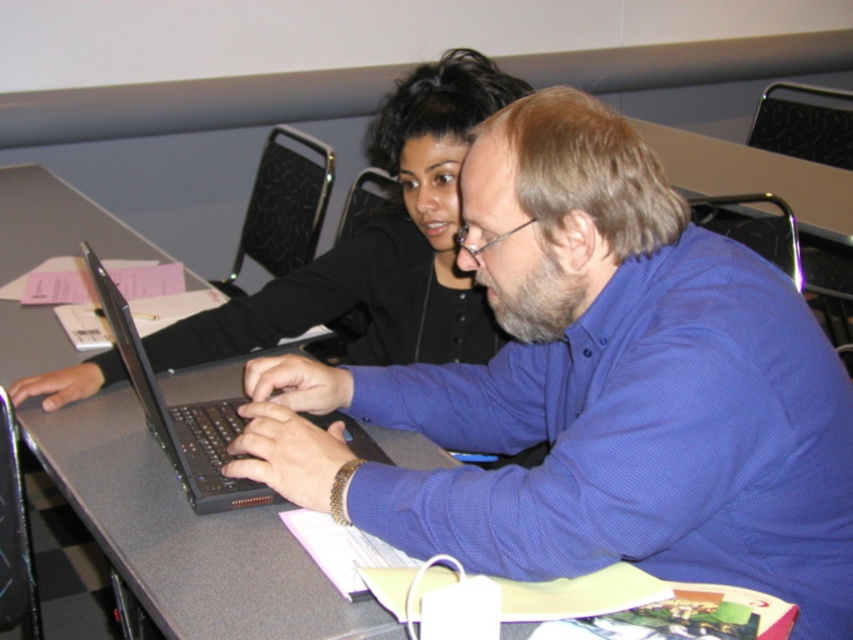
You are a photographer trying to capture a clear shot of both the black matte shirt at upper center and the black matte laptop at center. Since you want both subjects in focus, you need to adjust your camera settings based on their height. Which object should you focus on first to ensure both are in focus?

The black matte shirt at upper center is taller than the black matte laptop at center, so focusing on the taller object first will help ensure both are in focus.

You are a photographer trying to capture a clear shot of both the blue matte shirt at center and the black matte shirt at upper center. Since you want both subjects to be fully visible in the frame, which one might you need to adjust the camera angle for, and why?

The blue matte shirt at center has a greater height compared to the black matte shirt at upper center. Therefore, you might need to adjust the camera angle to ensure the taller blue matte shirt at center does not block the view of the shorter black matte shirt at upper center.

You are a photographer standing in front of the scene. You need to take a photo that includes both the black matte shirt at upper center and the black matte laptop at center. Which object should you focus on first to ensure both are in sharp focus?

You should focus on the black matte shirt at upper center first because it is closer to you than the black matte laptop at center. By focusing on the closer object, the depth of field may also keep the laptop in focus.